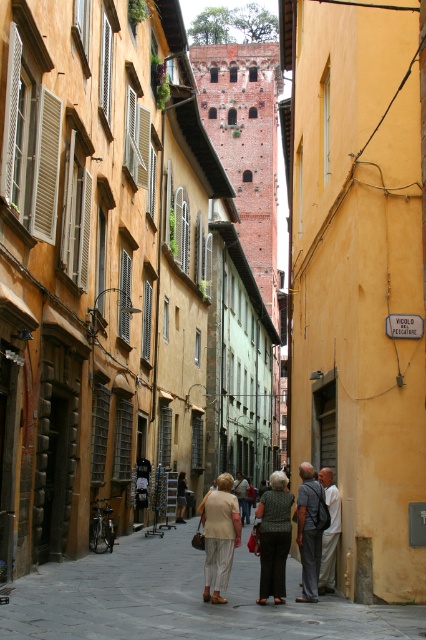
Does dark gray textured pants at center have a greater width compared to light beige pants at center?

Correct, the width of dark gray textured pants at center exceeds that of light beige pants at center.

Does dark gray textured pants at center have a lesser width compared to light beige pants at center?

Incorrect, dark gray textured pants at center's width is not less than light beige pants at center's.

Where is `dark gray textured pants at center`? The height and width of the screenshot is (640, 426). dark gray textured pants at center is located at coordinates (273, 538).

This screenshot has width=426, height=640. Identify the location of dark gray textured pants at center. (273, 538).

Who is positioned more to the left, light beige fabric coat at center or light beige pants at center?

light beige fabric coat at center

Is light beige fabric coat at center further to the viewer compared to light beige pants at center?

No.

Does point (218, 568) come closer to viewer compared to point (333, 573)?

Yes, it is.

Locate an element on the screen. Image resolution: width=426 pixels, height=640 pixels. light beige fabric coat at center is located at coordinates (x=219, y=536).

Is light beige pants at center closer to the viewer compared to light beige fabric dress at center?

Yes.

Between light beige pants at center and light beige fabric dress at center, which one appears on the left side from the viewer's perspective?

light beige fabric dress at center is more to the left.

Between point (330, 561) and point (178, 500), which one is positioned behind?

The point (178, 500) is more distant.

I want to click on light beige pants at center, so click(328, 532).